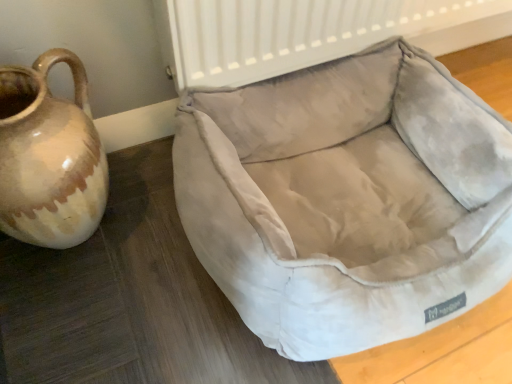
Locate an element on the screen. This screenshot has height=384, width=512. free space that is in between brown glazed jug at left and suede-like beige dog bed at center is located at coordinates (137, 286).